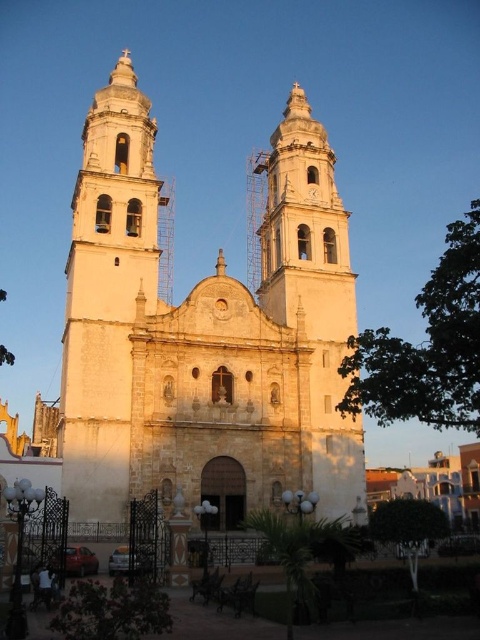
You are a tourist standing in front of the white stone church at center and the white stone tower at left. You want to take a photo that captures both structures in the frame. Which structure should you position closer to the edge of the frame to ensure both fit?

Since the white stone church at center is wider than the white stone tower at left, you should position the white stone tower at left closer to the edge of the frame to ensure both fit in the photo.

You are standing in front of the grand historic church and want to take a photo that captures both the white stone church at center and the white stone tower at left. Since you want to include both in the frame, which one should you focus on to ensure both are visible?

You should focus on the white stone church at center because it is taller than the white stone tower at left, so by centering the camera on the church, both structures will be within the frame.